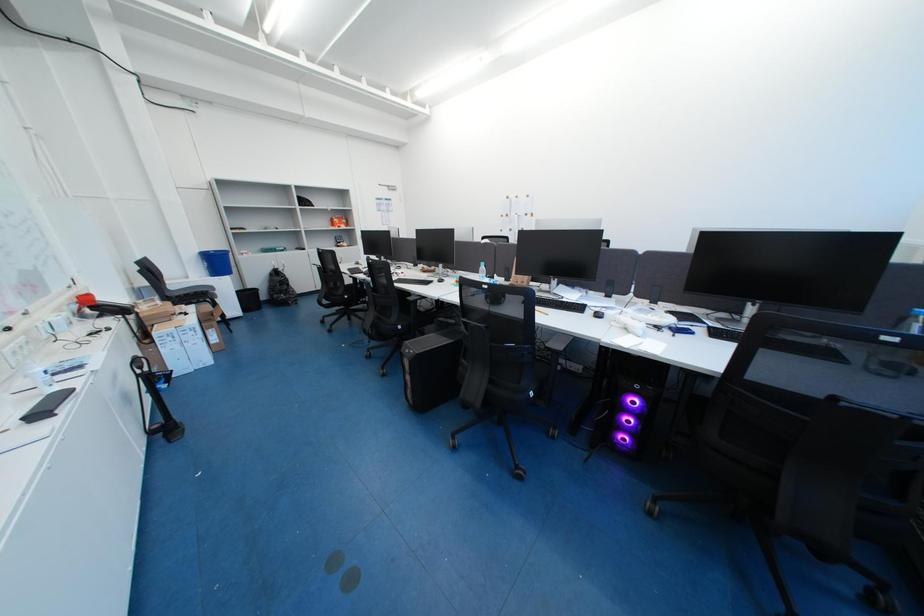
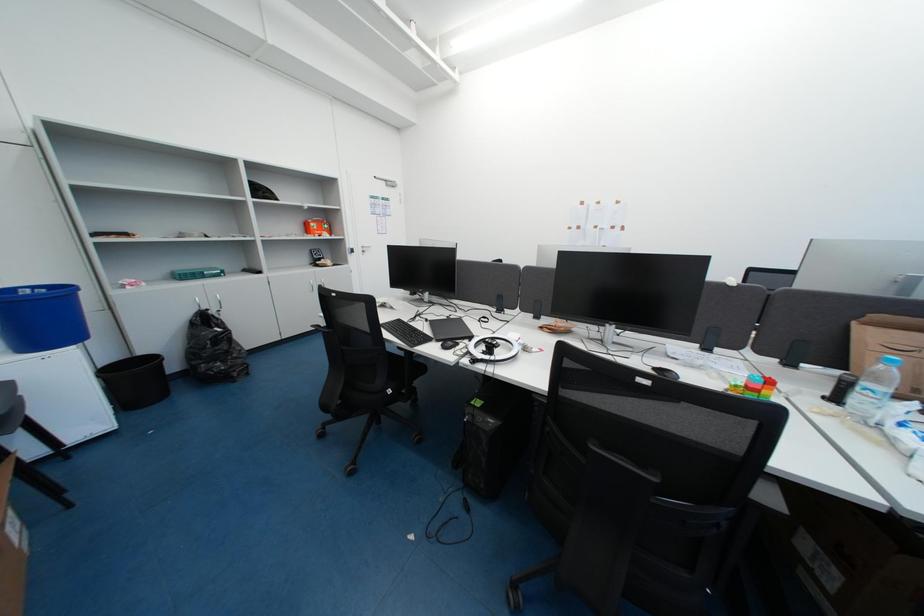
The images are taken continuously from a first-person perspective. In which direction are you moving?

The movement direction of the cameraman is left, forward.